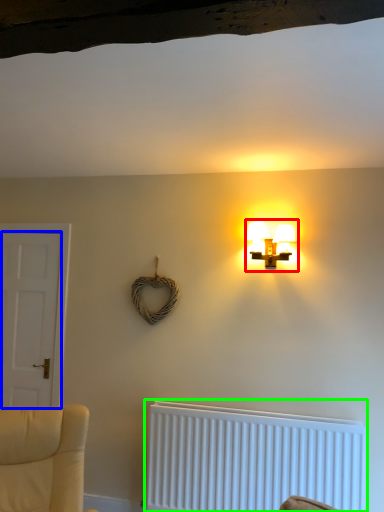
Question: Based on their relative distances, which object is farther from lamp (highlighted by a red box)? Choose from door (highlighted by a blue box) and radiator (highlighted by a green box).

Choices:
 (A) door
 (B) radiator

Answer: (A)